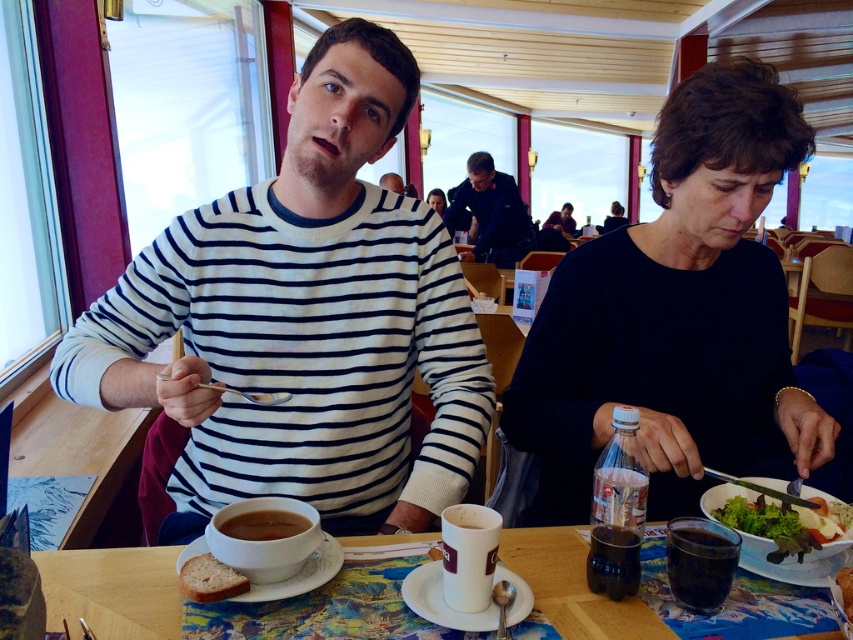
You are a waiter standing at the edge of the table, and you need to place a new white ceramic plate at lower left. The plate you have is 10 inches in diameter. Can you fit it in the space without overlapping the existing plate?

The distance between the white ceramic plate at lower left and the camera is 31.66 inches, so the space is sufficient to place a 10 inch diameter plate without overlapping the existing one.